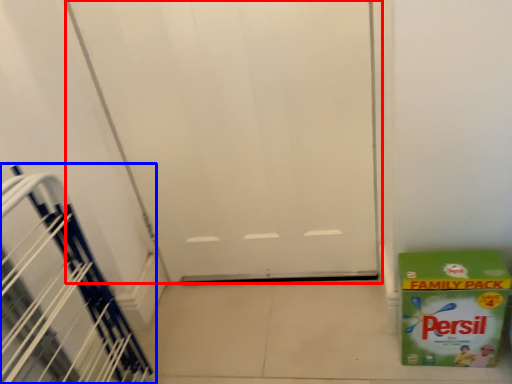
Question: Which of the following is the farthest to the observer, door (highlighted by a red box) or stairwell (highlighted by a blue box)?

Choices:
 (A) door
 (B) stairwell

Answer: (A)